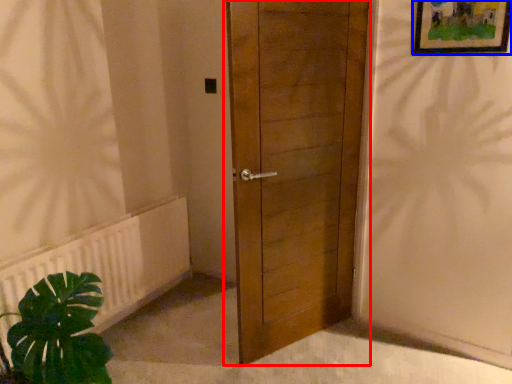
Question: Which point is closer to the camera, door (highlighted by a red box) or picture frame (highlighted by a blue box)?

Choices:
 (A) door
 (B) picture frame

Answer: (A)